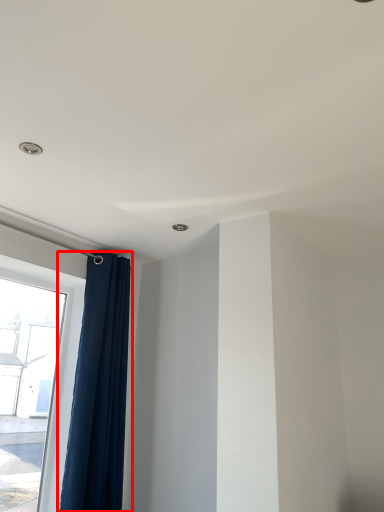
Question: From the image's perspective, where is curtain (annotated by the red box) located in relation to window in the image?

Choices:
 (A) above
 (B) below

Answer: (A)